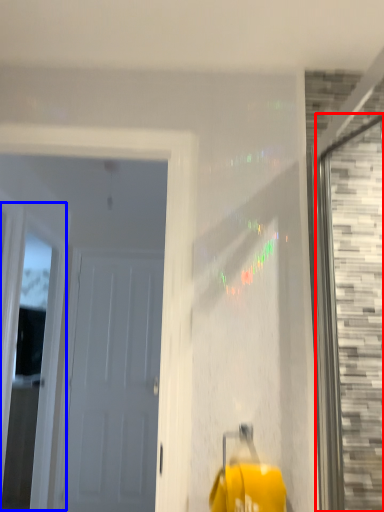
Question: Which of the following is the farthest to the observer, window (highlighted by a red box) or window (highlighted by a blue box)?

Choices:
 (A) window
 (B) window

Answer: (B)